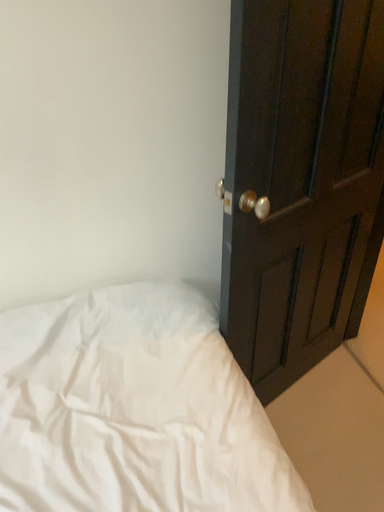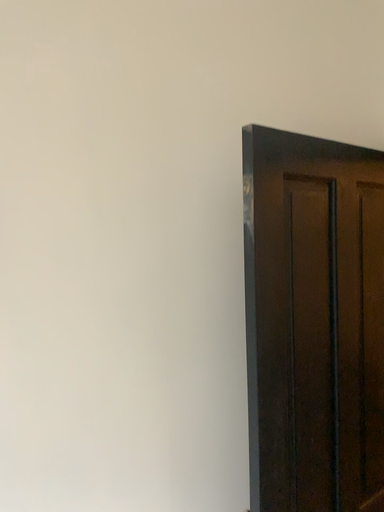
Question: How did the camera likely rotate when shooting the video?

Choices:
 (A) rotated downward
 (B) rotated upward

Answer: (B)